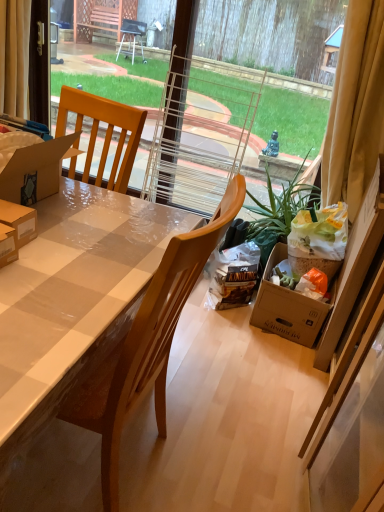
Question: Is yellow fabric curtain at upper right, which ranks as the first curtain in right-to-left order, next to beige fabric curtain at upper left, the 2th curtain viewed from the right?

Choices:
 (A) no
 (B) yes

Answer: (A)

Question: Would you consider yellow fabric curtain at upper right, which ranks as the first curtain in right-to-left order, to be distant from beige fabric curtain at upper left, placed as the first curtain when sorted from left to right?

Choices:
 (A) yes
 (B) no

Answer: (A)

Question: Is yellow fabric curtain at upper right, marked as the 2th curtain in a left-to-right arrangement, oriented towards beige fabric curtain at upper left, placed as the first curtain when sorted from left to right?

Choices:
 (A) no
 (B) yes

Answer: (A)

Question: From the image's perspective, is yellow fabric curtain at upper right, which ranks as the first curtain in right-to-left order, below beige fabric curtain at upper left, placed as the first curtain when sorted from left to right?

Choices:
 (A) yes
 (B) no

Answer: (A)

Question: Can you confirm if yellow fabric curtain at upper right, which ranks as the first curtain in right-to-left order, is positioned to the right of beige fabric curtain at upper left, placed as the first curtain when sorted from left to right?

Choices:
 (A) no
 (B) yes

Answer: (B)

Question: Is beige fabric curtain at upper left, the 2th curtain viewed from the right, bigger or smaller than wooden chair at center?

Choices:
 (A) big
 (B) small

Answer: (B)

Question: Considering the positions of beige fabric curtain at upper left, the 2th curtain viewed from the right, and wooden chair at center in the image, is beige fabric curtain at upper left, the 2th curtain viewed from the right, wider or thinner than wooden chair at center?

Choices:
 (A) wide
 (B) thin

Answer: (B)

Question: From the image's perspective, relative to wooden chair at center, is beige fabric curtain at upper left, placed as the first curtain when sorted from left to right, above or below?

Choices:
 (A) below
 (B) above

Answer: (B)

Question: Do you think beige fabric curtain at upper left, the 2th curtain viewed from the right, is within wooden chair at center, or outside of it?

Choices:
 (A) outside
 (B) inside

Answer: (A)

Question: In the image, is wooden chair at center on the left side or the right side of beige fabric curtain at upper left, placed as the first curtain when sorted from left to right?

Choices:
 (A) left
 (B) right

Answer: (B)

Question: Is wooden chair at center in front of or behind beige fabric curtain at upper left, placed as the first curtain when sorted from left to right, in the image?

Choices:
 (A) front
 (B) behind

Answer: (A)

Question: Considering the positions of wooden chair at center and beige fabric curtain at upper left, placed as the first curtain when sorted from left to right, in the image, is wooden chair at center wider or thinner than beige fabric curtain at upper left, placed as the first curtain when sorted from left to right,?

Choices:
 (A) wide
 (B) thin

Answer: (A)

Question: In terms of height, does wooden chair at center look taller or shorter compared to beige fabric curtain at upper left, placed as the first curtain when sorted from left to right?

Choices:
 (A) tall
 (B) short

Answer: (A)

Question: From a real-world perspective, relative to wooden chair at center, is yellow fabric curtain at upper right, which ranks as the first curtain in right-to-left order, vertically above or below?

Choices:
 (A) below
 (B) above

Answer: (B)

Question: Is yellow fabric curtain at upper right, marked as the 2th curtain in a left-to-right arrangement, bigger or smaller than wooden chair at center?

Choices:
 (A) big
 (B) small

Answer: (B)